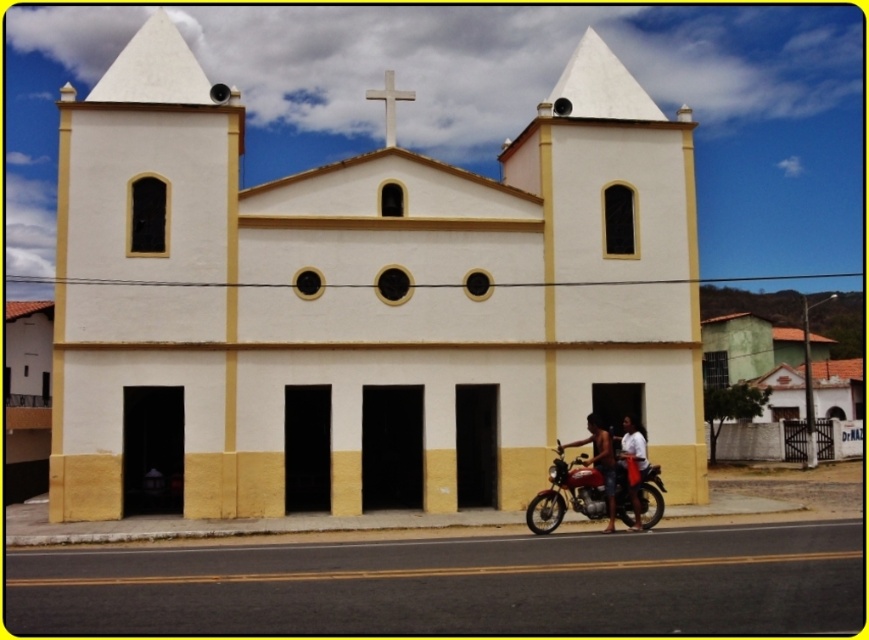
Is white matte church at center wider than metallic red motorcycle at lower right?

Correct, the width of white matte church at center exceeds that of metallic red motorcycle at lower right.

Can you confirm if white matte church at center is positioned to the right of metallic red motorcycle at lower right?

No, white matte church at center is not to the right of metallic red motorcycle at lower right.

Is point (176, 44) positioned in front of point (642, 516)?

No, (176, 44) is further to viewer.

Image resolution: width=869 pixels, height=640 pixels. I want to click on white matte church at center, so click(x=363, y=301).

Does white matte church at center have a larger size compared to white smooth cross at upper center?

Indeed, white matte church at center has a larger size compared to white smooth cross at upper center.

Can you confirm if white matte church at center is positioned to the left of white smooth cross at upper center?

Correct, you'll find white matte church at center to the left of white smooth cross at upper center.

Which is behind, point (204, 76) or point (368, 90)?

Point (368, 90)

Where is `white matte church at center`? Image resolution: width=869 pixels, height=640 pixels. white matte church at center is located at coordinates (363, 301).

Which is more to the right, metallic red motorcycle at lower right or tan shorts at lower center?

From the viewer's perspective, tan shorts at lower center appears more on the right side.

Which is more to the left, metallic red motorcycle at lower right or tan shorts at lower center?

Positioned to the left is metallic red motorcycle at lower right.

Is point (547, 509) positioned in front of point (600, 465)?

Yes.

What are the coordinates of `metallic red motorcycle at lower right` in the screenshot? It's located at (567, 493).